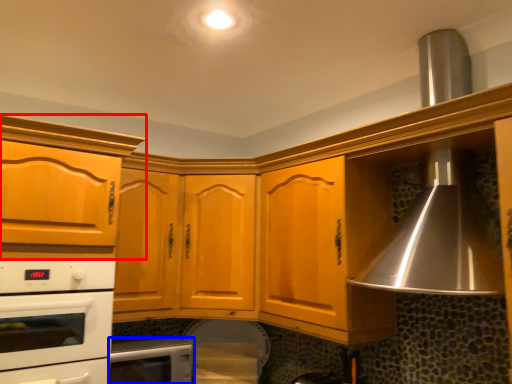
Question: Among these objects, which one is nearest to the camera, cabinetry (highlighted by a red box) or home appliance (highlighted by a blue box)?

Choices:
 (A) cabinetry
 (B) home appliance

Answer: (A)